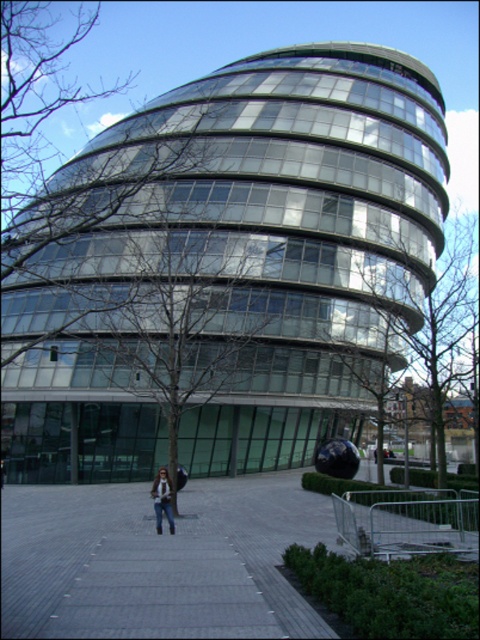
This screenshot has width=480, height=640. I want to click on gray concrete pavement at center, so click(158, 561).

Who is higher up, gray concrete pavement at center or denim jacket at center?

denim jacket at center is higher up.

Who is more distant from viewer, (137,564) or (154,502)?

Positioned behind is point (154,502).

In order to click on gray concrete pavement at center in this screenshot , I will do `click(158, 561)`.

Who is positioned more to the right, green leafy tree at center or denim jacket at center?

green leafy tree at center

Which is in front, point (444, 284) or point (156, 477)?

Point (444, 284)

Locate an element on the screen. green leafy tree at center is located at coordinates (429, 330).

Who is lower down, gray concrete pavement at center or green leafy tree at center?

gray concrete pavement at center is lower down.

Find the location of a particular element. The width and height of the screenshot is (480, 640). gray concrete pavement at center is located at coordinates (158, 561).